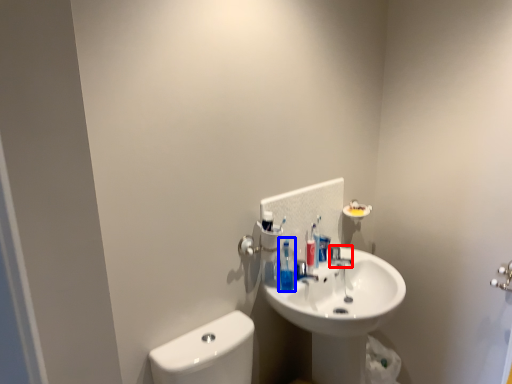
Question: Among these objects, which one is nearest to the camera, plumbing fixture (highlighted by a red box) or toiletry (highlighted by a blue box)?

Choices:
 (A) plumbing fixture
 (B) toiletry

Answer: (B)